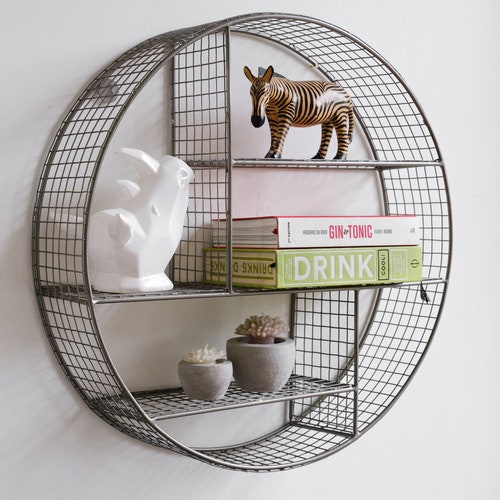
The image size is (500, 500). I want to click on zebra statue, so click(296, 113).